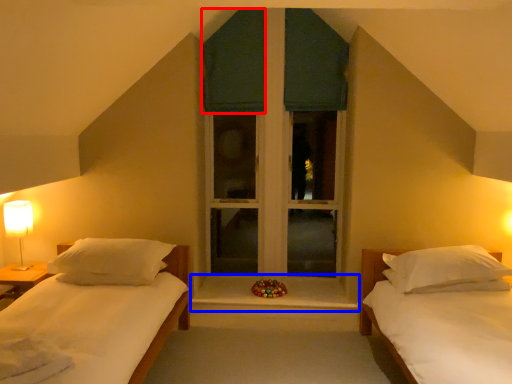
Question: Which of the following is the farthest to the observer, curtain (highlighted by a red box) or window sill (highlighted by a blue box)?

Choices:
 (A) curtain
 (B) window sill

Answer: (A)